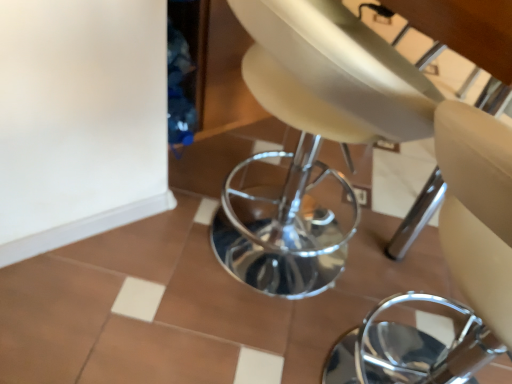
You are a GUI agent. You are given a task and a screenshot of the screen. Output one action in this format:
    pyautogui.click(x=<x>, y=<y>)
    Task: Click on the vacant space that is in between beige leather swivel chair at center and white glossy tile at lower left
    The image size is (512, 384).
    Given the screenshot: What is the action you would take?
    pyautogui.click(x=134, y=276)